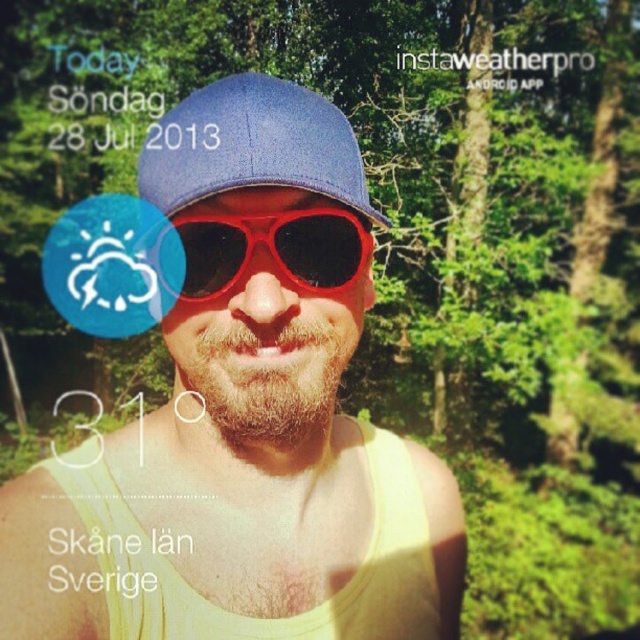
Between matte yellow tank top at center and shiny plastic goggles at center, which one has more height?

With more height is matte yellow tank top at center.

Does point (173, 605) come closer to viewer compared to point (321, 248)?

That is False.

I want to click on matte yellow tank top at center, so click(x=244, y=419).

Who is lower down, blue textured baseball cap at center or shiny plastic goggles at center?

shiny plastic goggles at center is below.

Does point (244, 180) lie behind point (356, 225)?

That is False.

This screenshot has width=640, height=640. I want to click on blue textured baseball cap at center, so click(252, 145).

Who is positioned more to the left, matte yellow tank top at center or blue textured baseball cap at center?

Positioned to the left is matte yellow tank top at center.

Between point (339, 477) and point (202, 157), which one is positioned behind?

Point (339, 477)

Is point (253, 589) less distant than point (316, 176)?

No, (253, 589) is further to viewer.

Locate an element on the screen. matte yellow tank top at center is located at coordinates (244, 419).